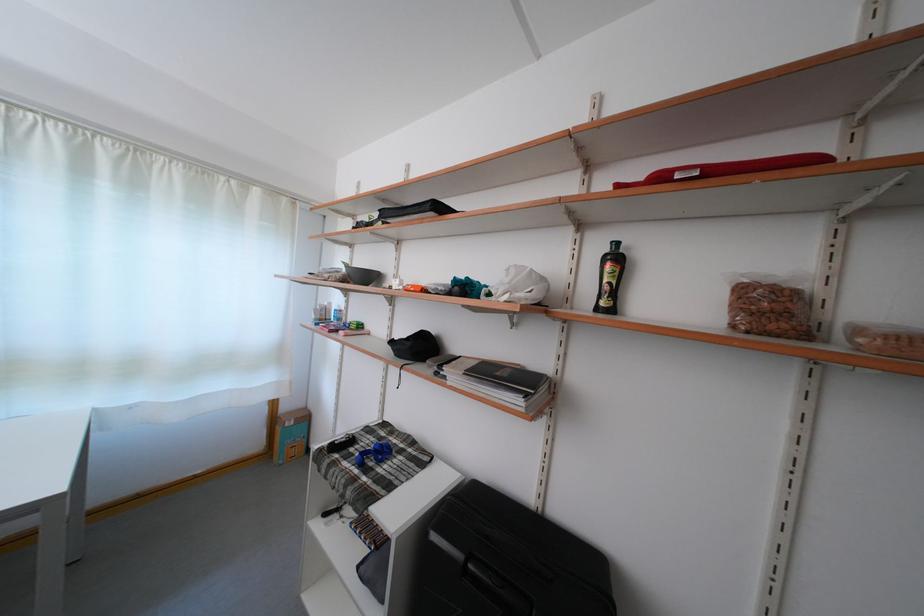
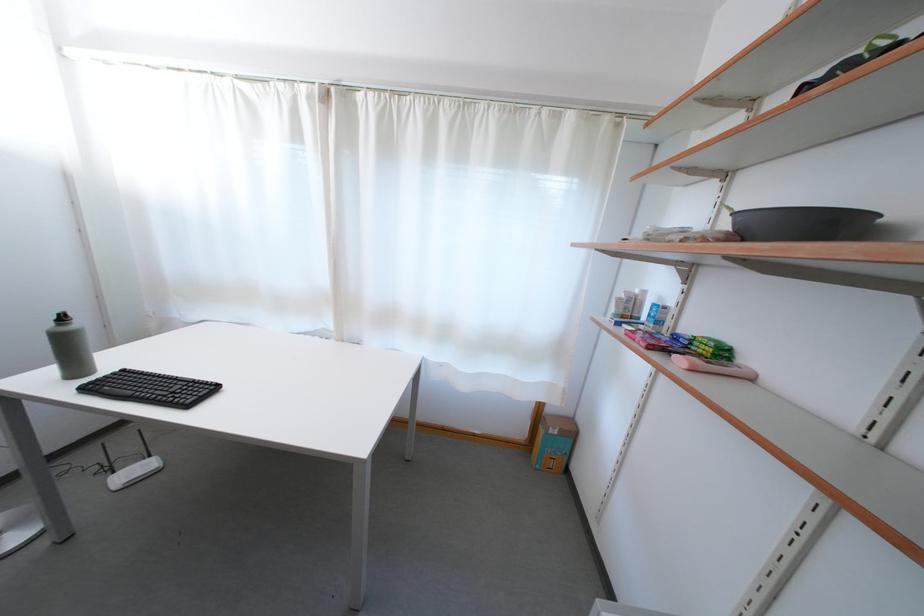
Question: The first image is from the beginning of the video and the second image is from the end. How did the camera likely rotate when shooting the video?

Choices:
 (A) Left
 (B) Right
 (C) Up
 (D) Down

Answer: (A)